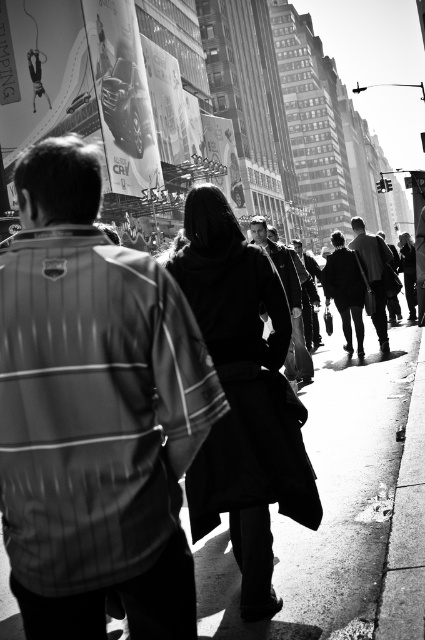
Can you confirm if black wool coat at center is taller than metallic silver car at upper center?

No, black wool coat at center is not taller than metallic silver car at upper center.

Measure the distance between black wool coat at center and metallic silver car at upper center.

The distance of black wool coat at center from metallic silver car at upper center is 31.00 meters.

This screenshot has width=425, height=640. I want to click on black wool coat at center, so click(x=243, y=396).

Is striped fabric jacket at upper left to the left of metallic silver car at upper center from the viewer's perspective?

In fact, striped fabric jacket at upper left is to the right of metallic silver car at upper center.

The height and width of the screenshot is (640, 425). Identify the location of striped fabric jacket at upper left. (95, 413).

Is point (78, 374) behind point (141, 156)?

That is False.

Locate an element on the screen. The width and height of the screenshot is (425, 640). striped fabric jacket at upper left is located at coordinates (95, 413).

Can you confirm if striped fabric jacket at upper left is positioned to the right of smooth asphalt sidewalk at center?

Incorrect, striped fabric jacket at upper left is not on the right side of smooth asphalt sidewalk at center.

Who is higher up, striped fabric jacket at upper left or smooth asphalt sidewalk at center?

striped fabric jacket at upper left

The width and height of the screenshot is (425, 640). In order to click on striped fabric jacket at upper left in this screenshot , I will do `click(95, 413)`.

At what (x,y) coordinates should I click in order to perform the action: click on striped fabric jacket at upper left. Please return your answer as a coordinate pair (x, y). The height and width of the screenshot is (640, 425). Looking at the image, I should click on (95, 413).